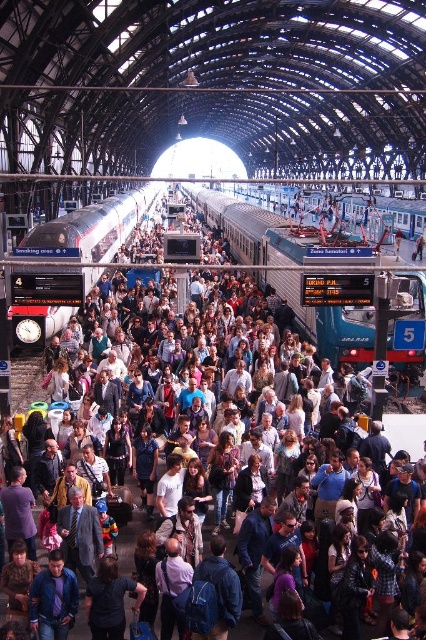
You are a maintenance worker needing to inspect both the teal metallic train at center and the silver metallic train at center. If your cart can move at 1.5 meters per second, how long will it take you to travel between them?

The distance between the teal metallic train at center and the silver metallic train at center is 26.84 meters. At a speed of 1.5 meters per second, the time required would be approximately 17.89 seconds.

You are standing on the platform at the train station and want to move from point A to point B. Point A is at coordinate point (247, 260) and point B is at coordinate point (60, 326). Considering the crowd density, which point is closer to you when you start at point A?

Point B at coordinate point (60, 326) is closer to you than point A at coordinate point (247, 260) because point A is further away from the viewer.

You are a passenger waiting at the train station and see both the teal metallic train at center and the silver metallic train at center. Which train is taller?

The teal metallic train at center is much taller than the silver metallic train at center.